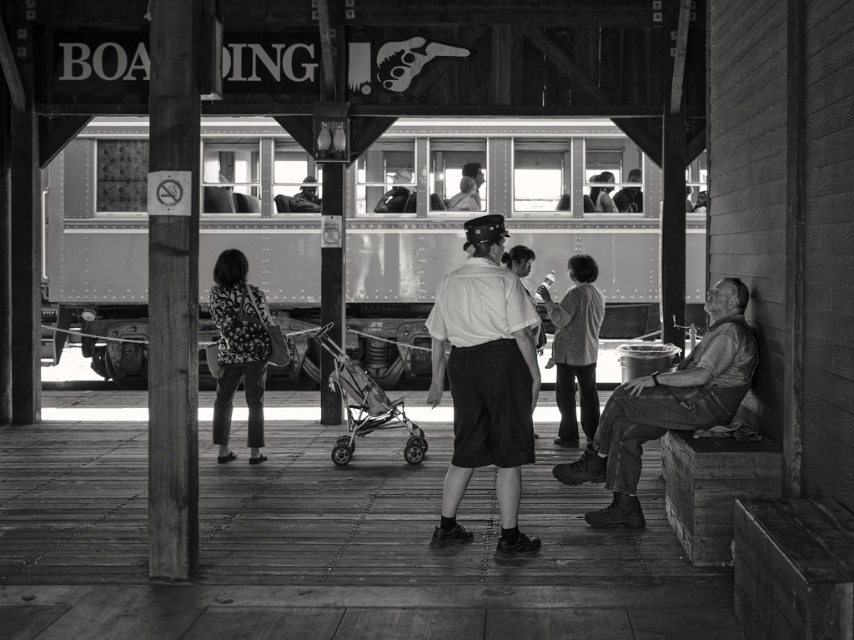
You are standing at the train station platform and see two points marked on the ground. The first point is at coordinate point (223, 298) and the second is at point (328, 352). If you are facing the direction of the train tracks, which point is closer to you?

Point (223, 298) is in front of point (328, 352), so if you are facing the train tracks, point (223, 298) is closer to you.

You are standing at the train station platform. There is a point marked at coordinates [501,205]. What object is located at that point?

The point at coordinates [501,205] is where the smooth metal train at center is located.